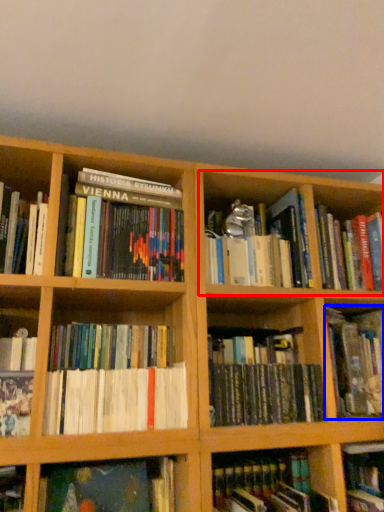
Question: Which object appears closest to the camera in this image, cabinet (highlighted by a red box) or book (highlighted by a blue box)?

Choices:
 (A) cabinet
 (B) book

Answer: (B)